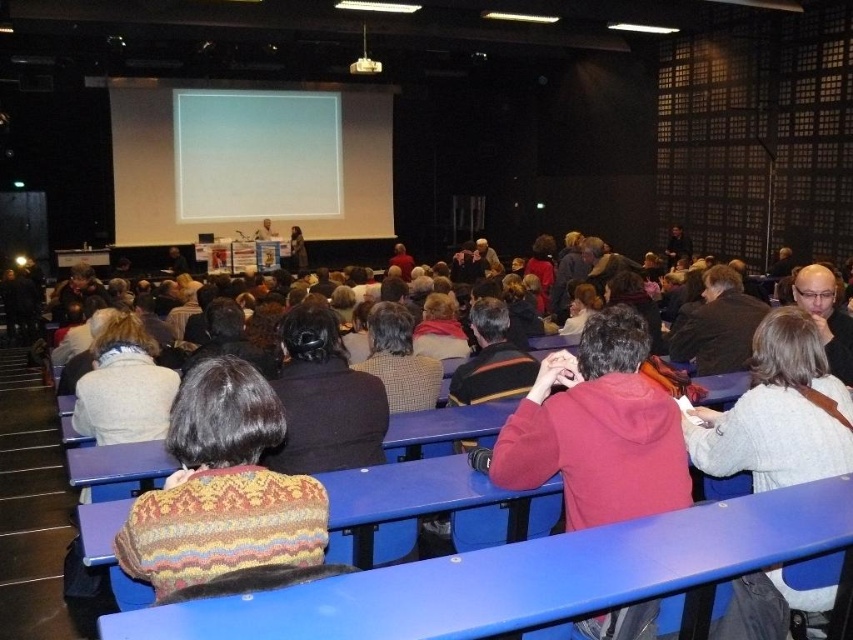
Between dark brown hair at center and white plastic projector at upper center, which one appears on the right side from the viewer's perspective?

Positioned to the right is dark brown hair at center.

Is dark brown hair at center to the right of white plastic projector at upper center from the viewer's perspective?

Indeed, dark brown hair at center is positioned on the right side of white plastic projector at upper center.

This screenshot has width=853, height=640. In order to click on dark brown hair at center in this screenshot , I will do 323,400.

Find the location of a particular element. dark brown hair at center is located at coordinates (323, 400).

Does white matte projection screen at upper center appear on the right side of dark brown leather jacket at center?

Incorrect, white matte projection screen at upper center is not on the right side of dark brown leather jacket at center.

Who is more distant from viewer, (276, 122) or (677, 333)?

Positioned behind is point (276, 122).

Between point (244, 116) and point (714, 275), which one is positioned behind?

The point (244, 116) is more distant.

Where is `white matte projection screen at upper center`? The image size is (853, 640). white matte projection screen at upper center is located at coordinates tap(256, 154).

Does white matte projection screen at upper center appear over checkered fabric sweater at center?

Correct, white matte projection screen at upper center is located above checkered fabric sweater at center.

Which of these two, white matte projection screen at upper center or checkered fabric sweater at center, stands shorter?

checkered fabric sweater at center is shorter.

Image resolution: width=853 pixels, height=640 pixels. Identify the location of white matte projection screen at upper center. (256, 154).